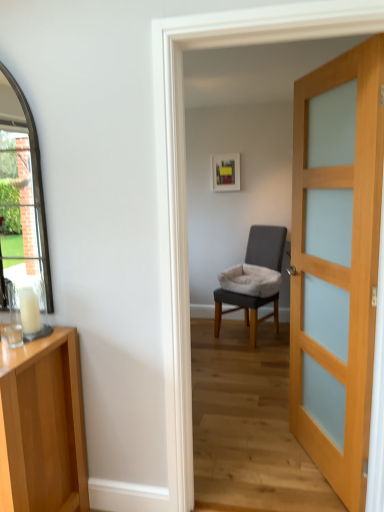
Question: Considering the relative positions of light wood cabinet at left and gray fabric chair at center in the image provided, is light wood cabinet at left to the left or to the right of gray fabric chair at center?

Choices:
 (A) left
 (B) right

Answer: (A)

Question: Considering the positions of light wood cabinet at left and gray fabric chair at center in the image, is light wood cabinet at left wider or thinner than gray fabric chair at center?

Choices:
 (A) wide
 (B) thin

Answer: (B)

Question: Estimate the real-world distances between objects in this image. Which object is farther from the gray fabric chair at center?

Choices:
 (A) wooden door at right
 (B) light wood cabinet at left

Answer: (B)

Question: Estimate the real-world distances between objects in this image. Which object is farther from the gray fabric chair at center?

Choices:
 (A) wooden door at right
 (B) light wood cabinet at left

Answer: (B)